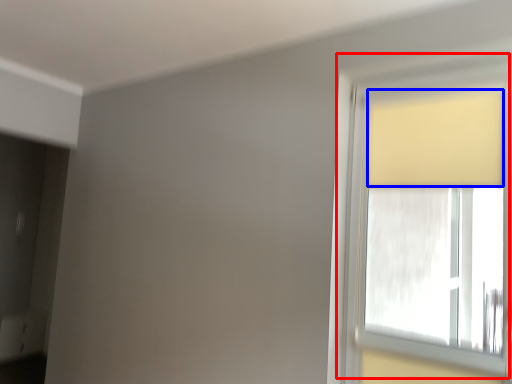
Question: Which object is closer to the camera taking this photo, window (highlighted by a red box) or curtain (highlighted by a blue box)?

Choices:
 (A) window
 (B) curtain

Answer: (A)